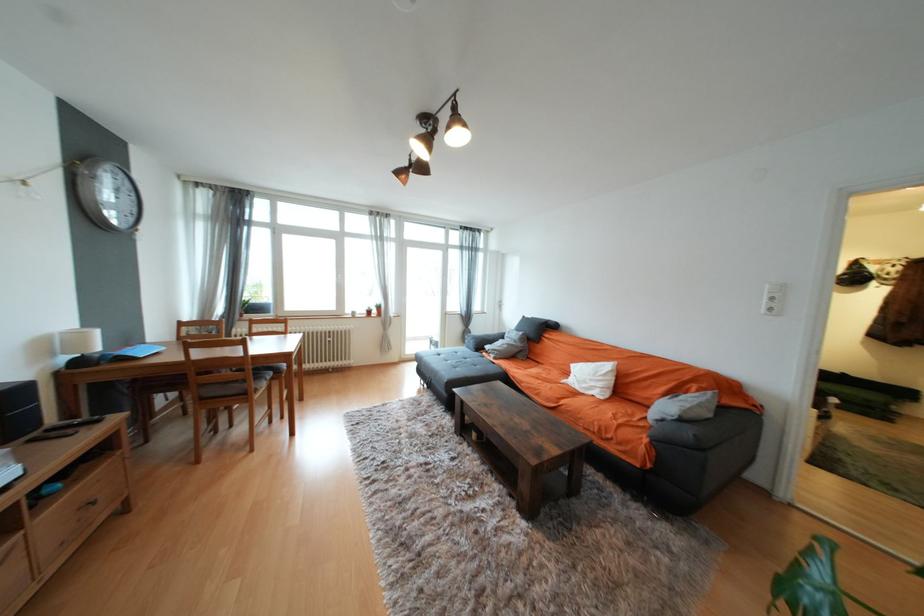
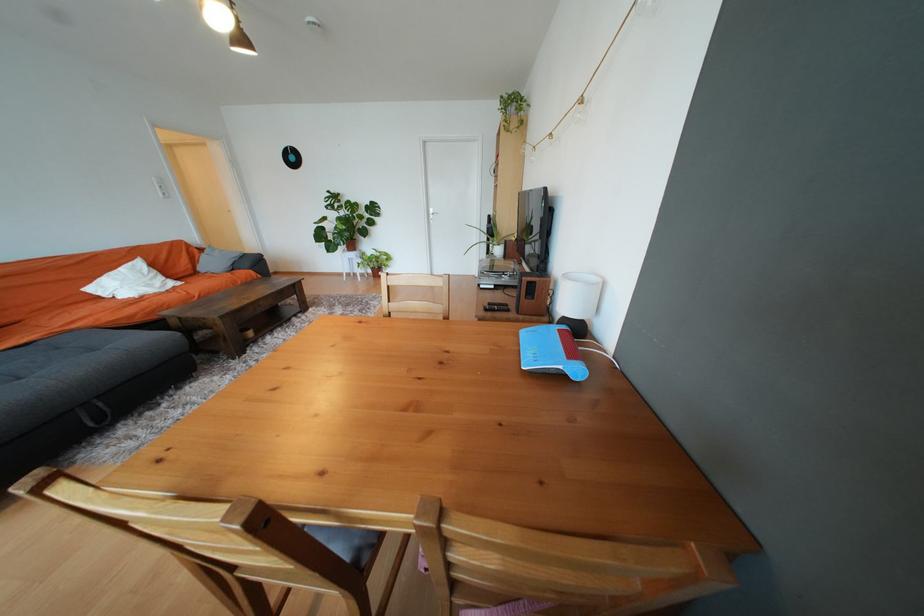
Find the pixel in the second image that matches the point at 699,391 in the first image.

(202, 252)